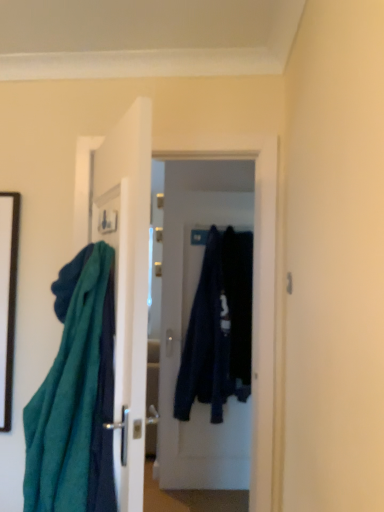
Question: From the image's perspective, is dark blue fabric at center, which is counted as the 2th clothing, starting from the right, located beneath dark blue fabric at center, which ranks as the first clothing in right-to-left order?

Choices:
 (A) yes
 (B) no

Answer: (A)

Question: From the image's perspective, is dark blue fabric at center, which appears as the 1th clothing when viewed from the left, over dark blue fabric at center, which appears as the second clothing when viewed from the left?

Choices:
 (A) yes
 (B) no

Answer: (B)

Question: From a real-world perspective, is dark blue fabric at center, which appears as the 1th clothing when viewed from the left, on top of dark blue fabric at center, which ranks as the first clothing in right-to-left order?

Choices:
 (A) no
 (B) yes

Answer: (A)

Question: Is dark blue fabric at center, which appears as the 1th clothing when viewed from the left, thinner than dark blue fabric at center, which ranks as the first clothing in right-to-left order?

Choices:
 (A) no
 (B) yes

Answer: (B)

Question: Is dark blue fabric at center, which appears as the 1th clothing when viewed from the left, at the right side of dark blue fabric at center, which appears as the second clothing when viewed from the left?

Choices:
 (A) no
 (B) yes

Answer: (A)

Question: In the image, is teal fabric at left positioned in front of or behind dark blue fabric at center, which ranks as the first clothing in right-to-left order?

Choices:
 (A) front
 (B) behind

Answer: (A)

Question: Looking at their shapes, would you say teal fabric at left is wider or thinner than dark blue fabric at center, which appears as the second clothing when viewed from the left?

Choices:
 (A) wide
 (B) thin

Answer: (B)

Question: From a real-world perspective, is teal fabric at left positioned above or below dark blue fabric at center, which appears as the second clothing when viewed from the left?

Choices:
 (A) above
 (B) below

Answer: (B)

Question: From the image's perspective, relative to dark blue fabric at center, which appears as the second clothing when viewed from the left, is teal fabric at left above or below?

Choices:
 (A) below
 (B) above

Answer: (A)

Question: In terms of height, does black matte picture frame at left look taller or shorter compared to dark blue fabric at center, which is counted as the 2th clothing, starting from the right?

Choices:
 (A) short
 (B) tall

Answer: (A)

Question: Relative to dark blue fabric at center, which is counted as the 2th clothing, starting from the right, is black matte picture frame at left in front or behind?

Choices:
 (A) behind
 (B) front

Answer: (B)

Question: From a real-world perspective, relative to dark blue fabric at center, which appears as the 1th clothing when viewed from the left, is black matte picture frame at left vertically above or below?

Choices:
 (A) above
 (B) below

Answer: (A)

Question: In terms of size, does black matte picture frame at left appear bigger or smaller than dark blue fabric at center, which is counted as the 2th clothing, starting from the right?

Choices:
 (A) small
 (B) big

Answer: (A)

Question: In terms of size, does teal fabric at left appear bigger or smaller than dark blue fabric at center, which is counted as the 2th clothing, starting from the right?

Choices:
 (A) big
 (B) small

Answer: (A)

Question: From a real-world perspective, is teal fabric at left physically located above or below dark blue fabric at center, which appears as the 1th clothing when viewed from the left?

Choices:
 (A) below
 (B) above

Answer: (A)